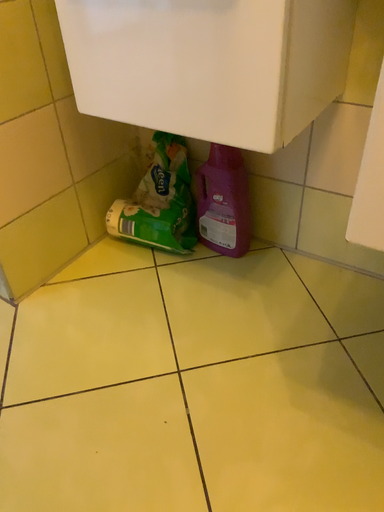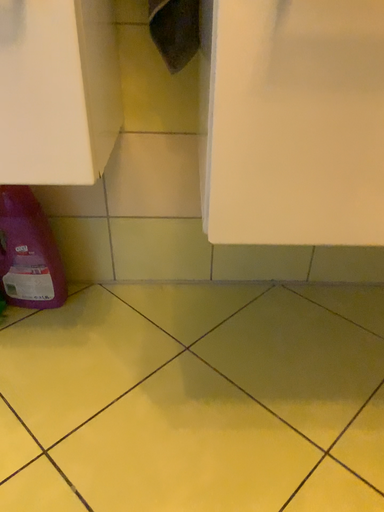
Question: Which way did the camera rotate in the video?

Choices:
 (A) rotated downward
 (B) rotated upward

Answer: (B)